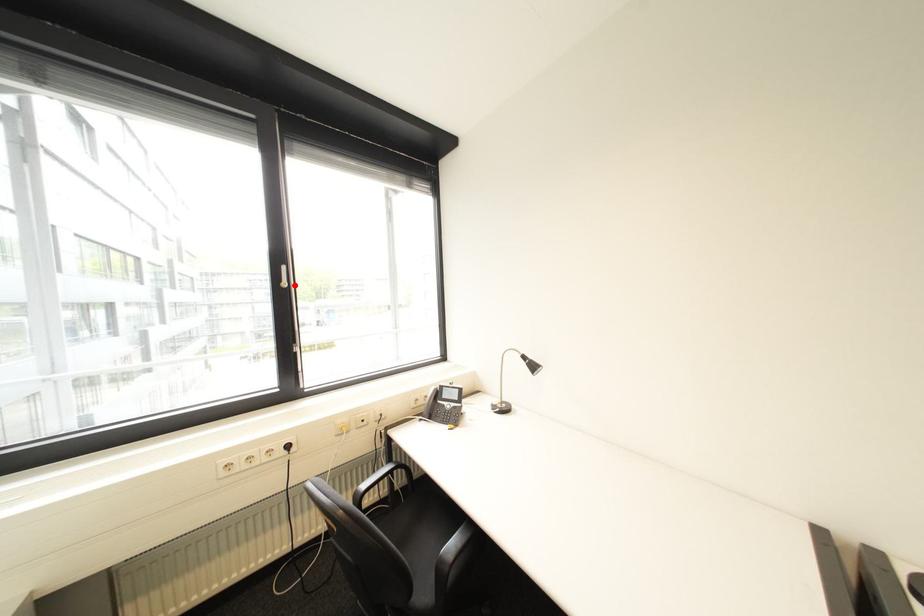
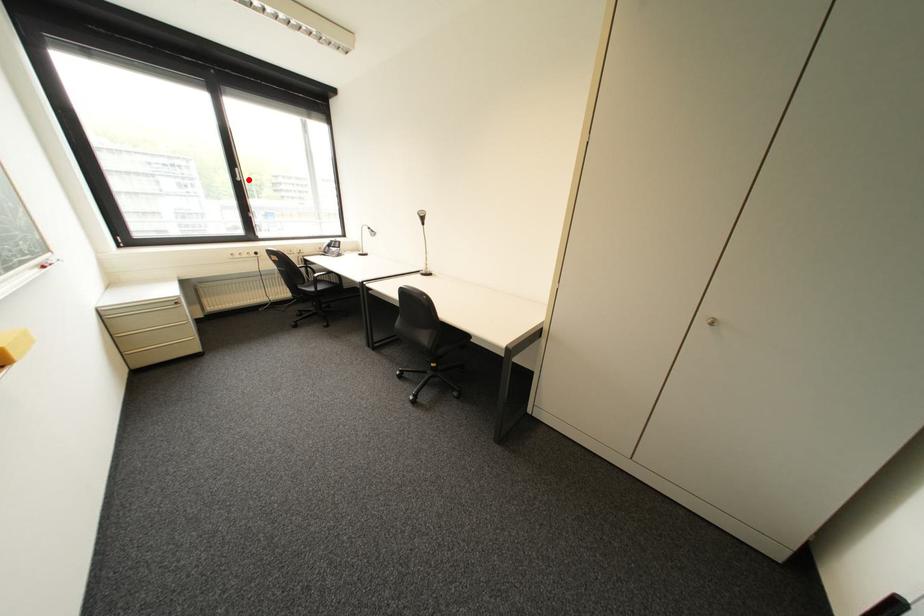
I am providing you with two images of the same scene from different viewpoints. A red point is marked on the first image and another point is marked on the second image. Is the marked point in image1 the same physical position as the marked point in image2?

Yes